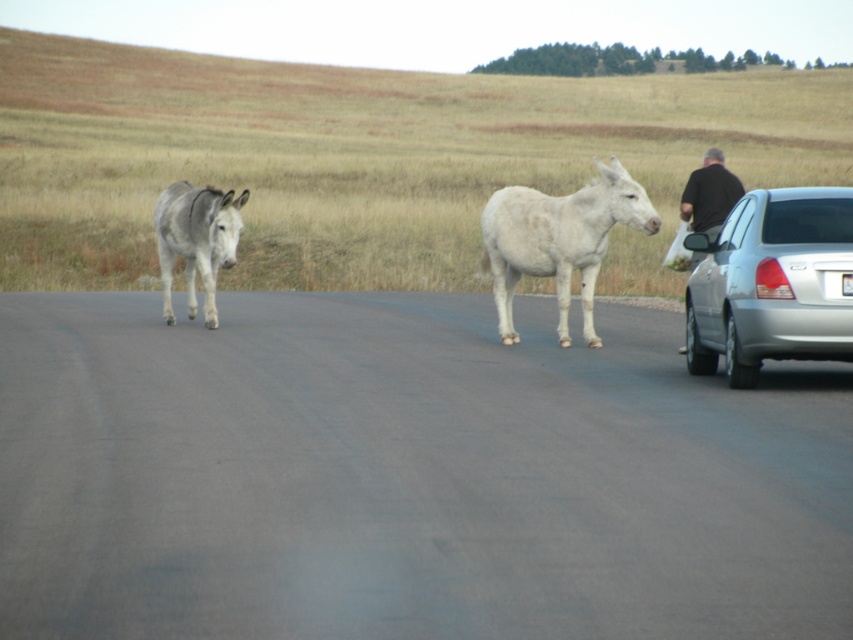
Question: Which object is closer to the camera taking this photo?

Choices:
 (A) silver metallic sedan at right
 (B) white matte donkey at center
 (C) gray matte donkey at left

Answer: (A)

Question: Which point appears farthest from the camera in this image?

Choices:
 (A) (576, 230)
 (B) (798, 312)
 (C) (709, 154)
 (D) (201, 276)

Answer: (D)

Question: Does gray matte donkey at left have a smaller size compared to black fabric at right?

Choices:
 (A) yes
 (B) no

Answer: (A)

Question: Does white matte donkey at center appear under black fabric at right?

Choices:
 (A) yes
 (B) no

Answer: (A)

Question: Where is silver metallic sedan at right located in relation to gray matte donkey at left in the image?

Choices:
 (A) left
 (B) right

Answer: (B)

Question: Which of the following is the closest to the observer?

Choices:
 (A) (512, 276)
 (B) (709, 236)

Answer: (B)